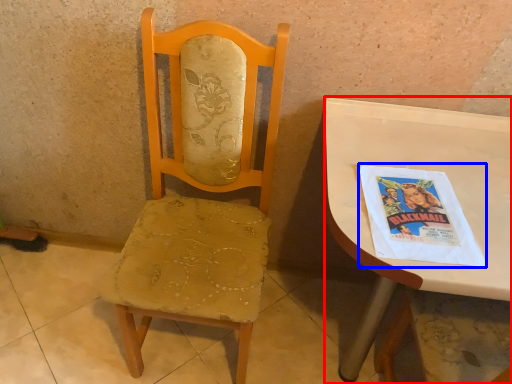
Question: Which point is further to the camera, desk (highlighted by a red box) or comic book (highlighted by a blue box)?

Choices:
 (A) desk
 (B) comic book

Answer: (B)